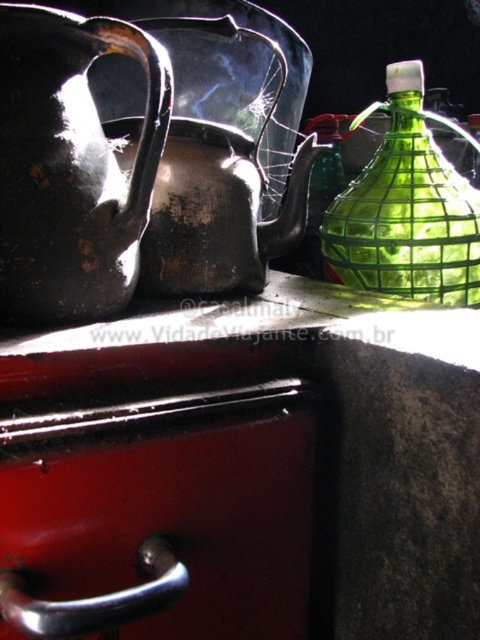
You are standing in the kitchen and want to reach both points. Which point, point (9, 515) or point (416, 108), is closer to you?

Point (9, 515) is closer to the viewer than point (416, 108).

You are organizing a small kitchen and need to place a 40 centimeter wide plate rack between the metallic red drawer at lower left and the shiny metallic teapot at upper center. Can the plate rack fit in the space between them?

The metallic red drawer at lower left is 41.01 centimeters from the shiny metallic teapot at upper center. Since the plate rack is 40 centimeters wide, it can fit in the space between them as the distance is slightly larger than the rack.